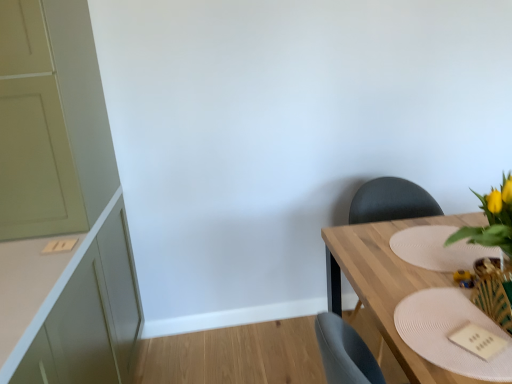
Question: Relative to matte black chair at right, is yellow artificial flowers at right in front or behind?

Choices:
 (A) front
 (B) behind

Answer: (A)

Question: From a real-world perspective, is yellow artificial flowers at right above or below matte black chair at right?

Choices:
 (A) above
 (B) below

Answer: (A)

Question: Estimate the real-world distances between objects in this image. Which object is farther from the wooden table at right?

Choices:
 (A) matte green cabinet at left
 (B) wooden textured vase at lower right
 (C) white textured placemat at right, positioned as the 2th plate in front-to-back order
 (D) matte black chair at right
 (E) white textured placemat at lower right, marked as the second plate in a back-to-front arrangement

Answer: (A)

Question: Which is nearer to the white textured placemat at lower right, which is counted as the 1th plate, starting from the front?

Choices:
 (A) white textured placemat at right, placed as the 2th plate when sorted from bottom to top
 (B) yellow artificial flowers at right
 (C) matte green cabinet at left
 (D) wooden table at right
 (E) wooden textured vase at lower right

Answer: (E)